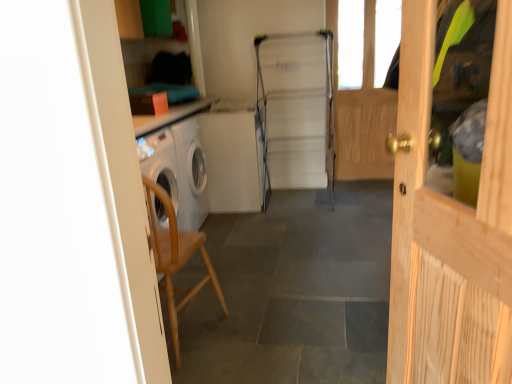
Question: Would you say metallic silver fridge at center is to the left or to the right of wooden chair at left in the picture?

Choices:
 (A) right
 (B) left

Answer: (A)

Question: In terms of width, does metallic silver fridge at center look wider or thinner when compared to wooden chair at left?

Choices:
 (A) wide
 (B) thin

Answer: (A)

Question: Estimate the real-world distances between objects in this image. Which object is farther from the wooden chair at left?

Choices:
 (A) light wood door at right
 (B) wooden chair at left
 (C) wooden screen door at right
 (D) metallic silver fridge at center

Answer: (C)

Question: Which object is the farthest from the wooden chair at left?

Choices:
 (A) light wood door at right
 (B) wooden screen door at right
 (C) metallic silver fridge at center
 (D) wooden chair at left

Answer: (B)